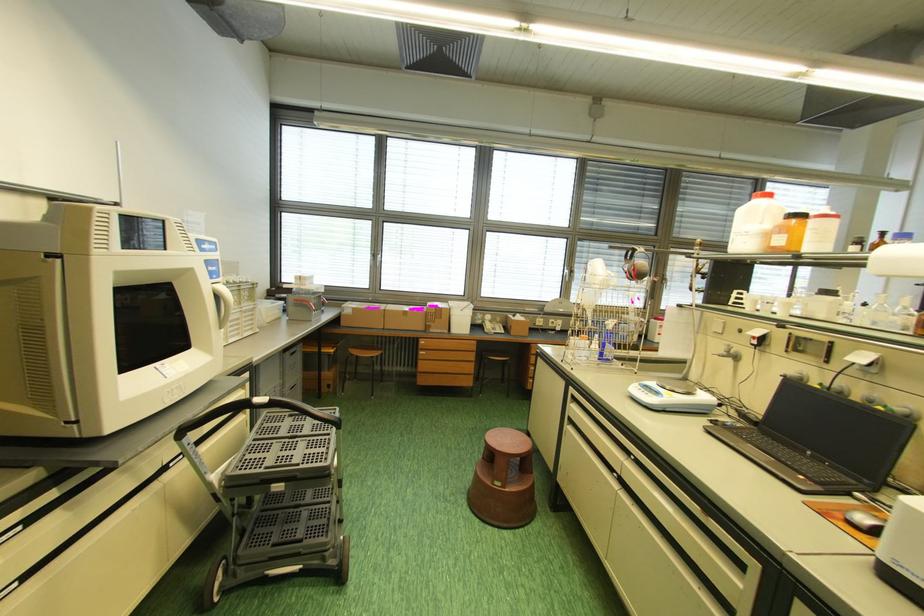
Find where to pull the grey cabinet handle. Please return your answer as a coordinate pair (x, y).

(426, 344)